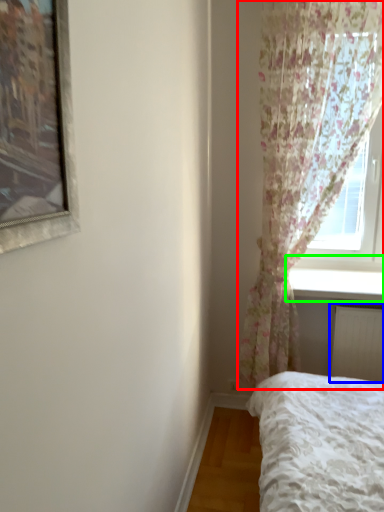
Question: Estimate the real-world distances between objects in this image. Which object is closer to curtain (highlighted by a red box), radiator (highlighted by a blue box) or window sill (highlighted by a green box)?

Choices:
 (A) radiator
 (B) window sill

Answer: (B)